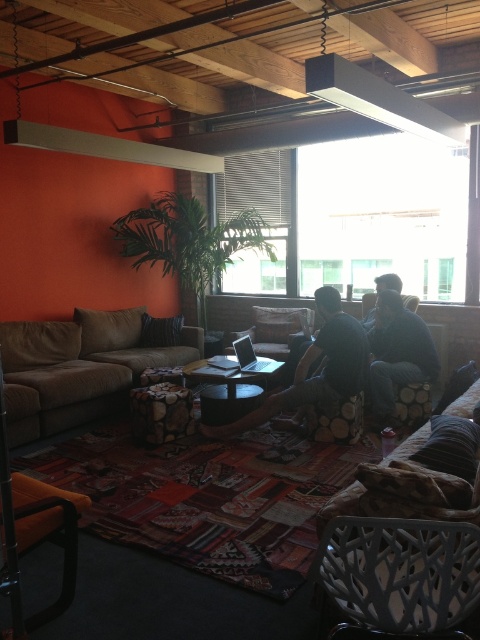
Consider the image. You are planning to hang a large painting on the wall behind the black textured armchair at center. Considering the position of the matte white beam at upper center, where should you place the painting to avoid blocking the beam?

The black textured armchair at center is below the matte white beam at upper center, so placing the painting above the armchair would ensure it stays below the beam and avoids blocking it.

You are trying to decide whether to place a rectangular coffee table between the black textured armchair at center and the dark blue jeans at center. The table is 1 meter wide. Can the table fit between them?

The black textured armchair at center is thinner than the dark blue jeans at center. However, the description does not provide specific measurements of their widths. Without knowing the exact distance between them, it is impossible to determine if the 1 meter wide coffee table can fit.